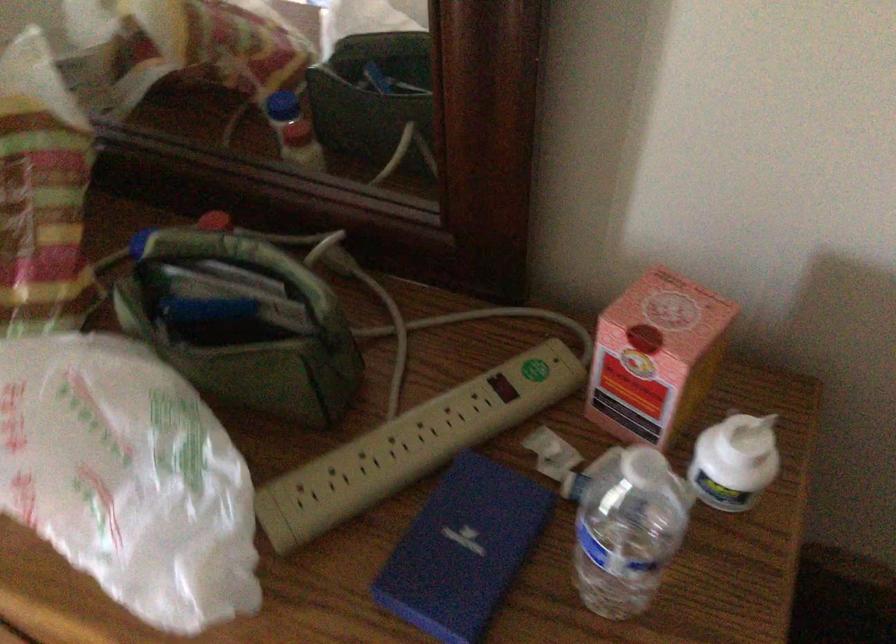
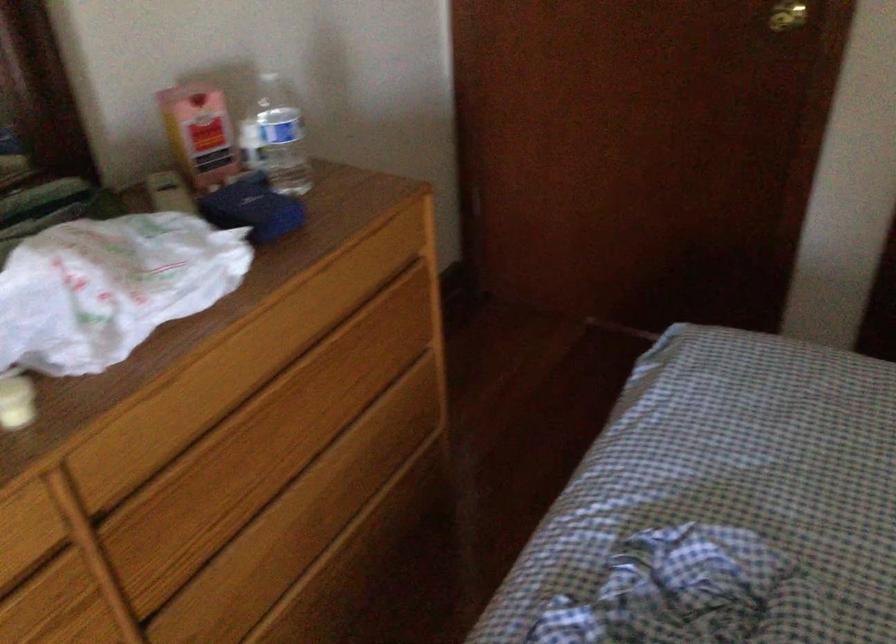
Find the pixel in the second image that matches [582,531] in the first image.

(276, 138)